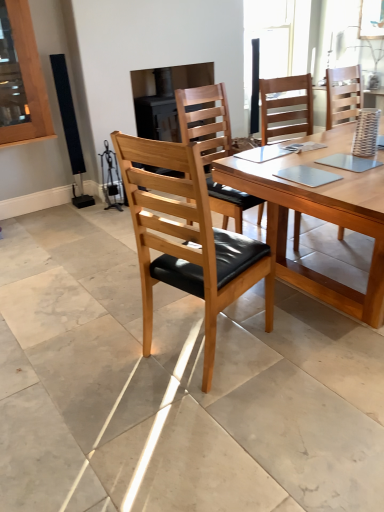
Identify the location of vacant area that lies in front of natural wood/black leather chair at center, the first chair from the left. (215, 416).